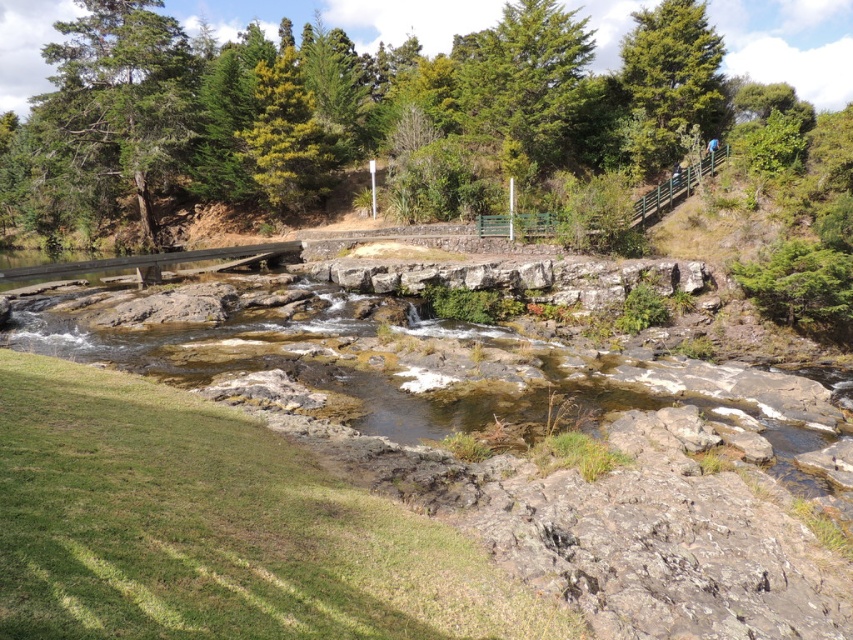
Is green rough bark tree at upper left below green textured tree at upper right?

Yes.

Who is taller, green rough bark tree at upper left or green textured tree at upper right?

With more height is green rough bark tree at upper left.

Which is behind, point (68, 140) or point (625, 49)?

Point (68, 140)

Identify the location of green rough bark tree at upper left. The image size is (853, 640). (119, 100).

What do you see at coordinates (288, 353) in the screenshot?
I see `rocky stream at center` at bounding box center [288, 353].

Does point (196, 346) come in front of point (474, 92)?

Yes, it is in front of point (474, 92).

I want to click on rocky stream at center, so click(x=288, y=353).

Is green rough bark tree at upper left taller than green textured tree at upper center?

In fact, green rough bark tree at upper left may be shorter than green textured tree at upper center.

Is green rough bark tree at upper left closer to the viewer compared to green textured tree at upper center?

No, it is behind green textured tree at upper center.

Between point (94, 92) and point (544, 22), which one is positioned behind?

Point (94, 92)

Find the location of a particular element. green rough bark tree at upper left is located at coordinates (119, 100).